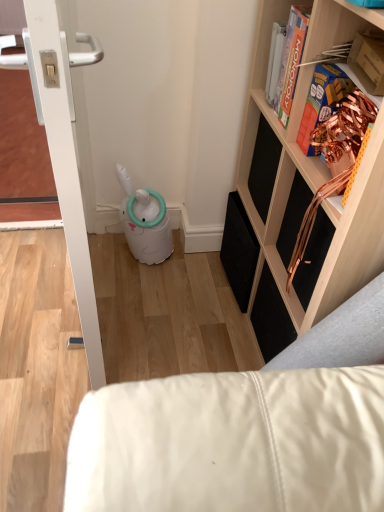
Question: Considering the relative sizes of white leather couch at lower right and wooden/black speaker at upper right in the image provided, is white leather couch at lower right thinner than wooden/black speaker at upper right?

Choices:
 (A) yes
 (B) no

Answer: (B)

Question: From the image's perspective, is white leather couch at lower right under wooden/black speaker at upper right?

Choices:
 (A) yes
 (B) no

Answer: (A)

Question: Is the depth of white leather couch at lower right greater than that of wooden/black speaker at upper right?

Choices:
 (A) no
 (B) yes

Answer: (B)

Question: Considering the relative positions of white leather couch at lower right and wooden/black speaker at upper right in the image provided, is white leather couch at lower right to the left of wooden/black speaker at upper right from the viewer's perspective?

Choices:
 (A) no
 (B) yes

Answer: (B)

Question: Can we say white leather couch at lower right lies outside wooden/black speaker at upper right?

Choices:
 (A) no
 (B) yes

Answer: (B)

Question: Is white leather couch at lower right oriented towards wooden/black speaker at upper right?

Choices:
 (A) yes
 (B) no

Answer: (B)

Question: Is wooden/black speaker at upper right oriented away from white glossy door at left?

Choices:
 (A) yes
 (B) no

Answer: (B)

Question: Is wooden/black speaker at upper right at the left side of white glossy door at left?

Choices:
 (A) yes
 (B) no

Answer: (B)

Question: Is wooden/black speaker at upper right surrounding white glossy door at left?

Choices:
 (A) no
 (B) yes

Answer: (A)

Question: Is wooden/black speaker at upper right beside white glossy door at left?

Choices:
 (A) no
 (B) yes

Answer: (A)

Question: From a real-world perspective, does wooden/black speaker at upper right stand above white glossy door at left?

Choices:
 (A) no
 (B) yes

Answer: (B)

Question: Is wooden/black speaker at upper right wider than white glossy door at left?

Choices:
 (A) yes
 (B) no

Answer: (A)

Question: Can we say white leather couch at lower right lies outside white glossy door at left?

Choices:
 (A) yes
 (B) no

Answer: (A)